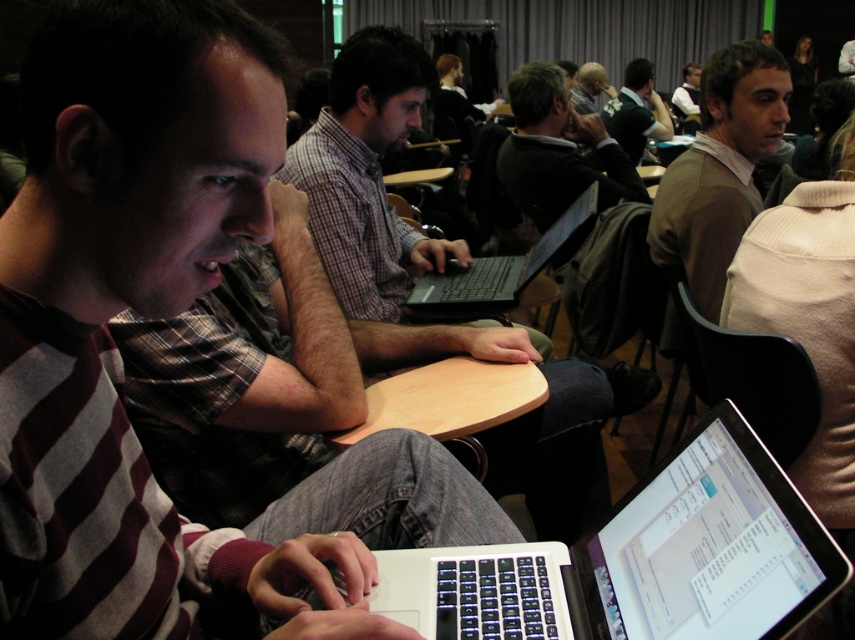
Question: Based on their relative distances, which object is nearer to the silver metallic laptop at center?

Choices:
 (A) wooden table at center
 (B) gray sweater at upper center
 (C) brown sweater at right
 (D) matte brown sweater at center

Answer: (C)

Question: Is dark green sweater at upper right to the right of wooden table at center from the viewer's perspective?

Choices:
 (A) yes
 (B) no

Answer: (A)

Question: Which point is closer to the camera taking this photo?

Choices:
 (A) (629, 96)
 (B) (617, 172)
 (C) (684, 65)
 (D) (388, 381)

Answer: (D)

Question: Observing the image, what is the correct spatial positioning of dark green sweater at upper right in reference to matte brown sweater at center?

Choices:
 (A) below
 (B) above

Answer: (A)

Question: Does plaid shirt at center have a larger size compared to black matte laptop at center?

Choices:
 (A) no
 (B) yes

Answer: (B)

Question: Based on their relative distances, which object is farther from the plaid shirt at center?

Choices:
 (A) striped sweater at left
 (B) gray sweater at upper center

Answer: (B)